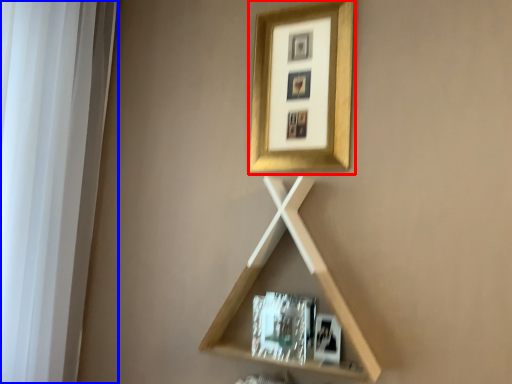
Question: Which of the following is the farthest to the observer, picture frame (highlighted by a red box) or window frame (highlighted by a blue box)?

Choices:
 (A) picture frame
 (B) window frame

Answer: (A)